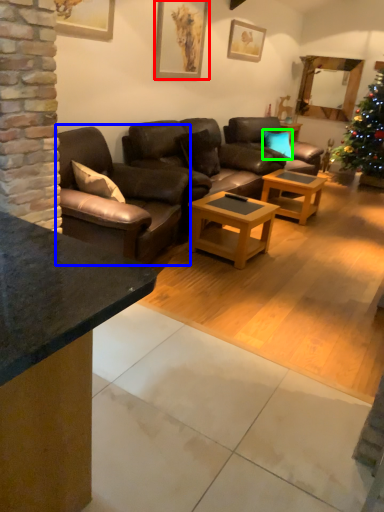
Question: Which is farther away from picture frame (highlighted by a red box)? studio couch (highlighted by a blue box) or pillow (highlighted by a green box)?

Choices:
 (A) studio couch
 (B) pillow

Answer: (B)